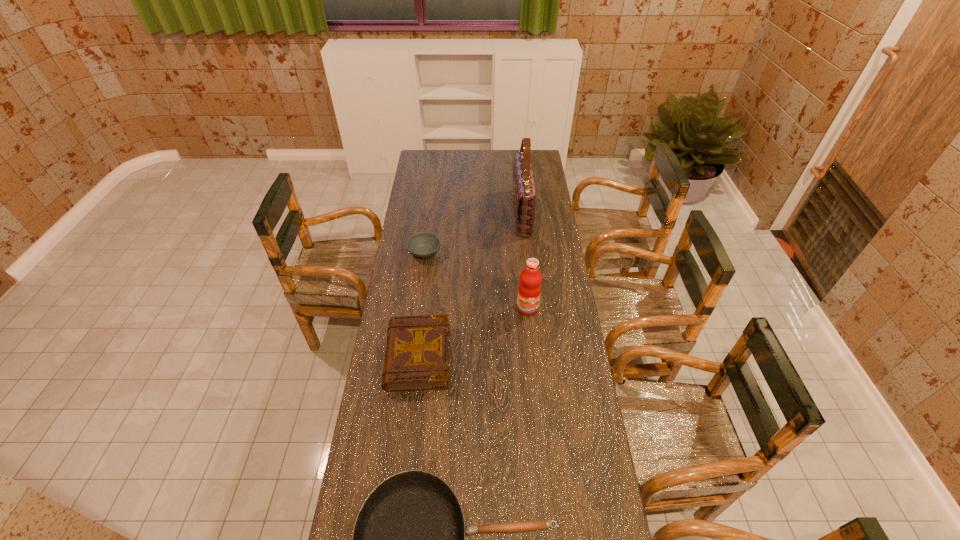
In order to click on vacant region located 0.260m on the front label of the third farthest object in this screenshot , I will do `click(534, 371)`.

The image size is (960, 540). Find the location of `free space located on the right of the hardback book`. free space located on the right of the hardback book is located at coordinates (504, 356).

The image size is (960, 540). Identify the location of vacant space located on the back of the fourth nearest object. (430, 206).

Locate an element on the screen. This screenshot has width=960, height=540. hardback book positioned at the left edge is located at coordinates (417, 351).

This screenshot has width=960, height=540. What are the coordinates of `soup bowl that is at the left edge` in the screenshot? It's located at (x=423, y=245).

This screenshot has width=960, height=540. Identify the location of handbag present at the right edge. (524, 193).

I want to click on fruit juice positioned at the right edge, so click(x=529, y=290).

In order to click on vacant space at the far edge of the desktop in this screenshot , I will do `click(474, 167)`.

Where is `vacant space at the left edge of the desktop`? This screenshot has width=960, height=540. vacant space at the left edge of the desktop is located at coordinates (418, 180).

Where is `free space at the right edge of the desktop`? The height and width of the screenshot is (540, 960). free space at the right edge of the desktop is located at coordinates (565, 345).